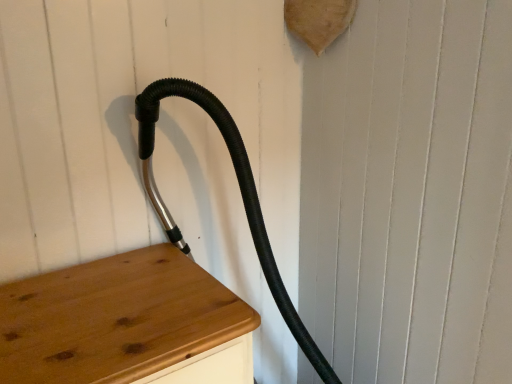
What do you see at coordinates (241, 195) in the screenshot? The width and height of the screenshot is (512, 384). I see `black rubber hose at upper left` at bounding box center [241, 195].

Locate an element on the screen. black rubber hose at upper left is located at coordinates (241, 195).

What is the approximate height of black rubber hose at upper left?

A: black rubber hose at upper left is 3.76 feet in height.

Find the location of a particular element. black rubber hose at upper left is located at coordinates (241, 195).